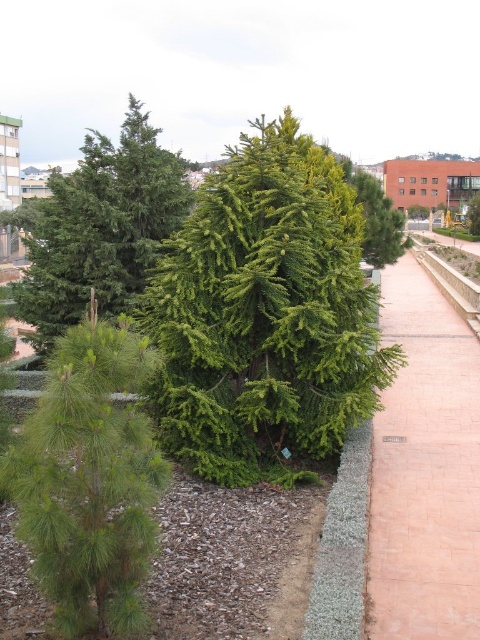
Question: Considering the relative positions of green leafy tree at center and green matte pine tree at left in the image provided, where is green leafy tree at center located with respect to green matte pine tree at left?

Choices:
 (A) left
 (B) right

Answer: (B)

Question: Can you confirm if green matte pine tree at left is thinner than green needle-like at center?

Choices:
 (A) no
 (B) yes

Answer: (B)

Question: Which of the following is the farthest from the observer?

Choices:
 (A) green leafy tree at center
 (B) pink brick pavement at right
 (C) green needle-like at center

Answer: (C)

Question: Does green leafy tree at center appear on the left side of green needle-like at center?

Choices:
 (A) no
 (B) yes

Answer: (A)

Question: Based on their relative distances, which object is farther from the green needle-like at center?

Choices:
 (A) pink brick pavement at right
 (B) green matte pine tree at left

Answer: (A)

Question: Which of these objects is positioned farthest from the green needle-like at center?

Choices:
 (A) pink brick pavement at right
 (B) green matte pine tree at left

Answer: (A)